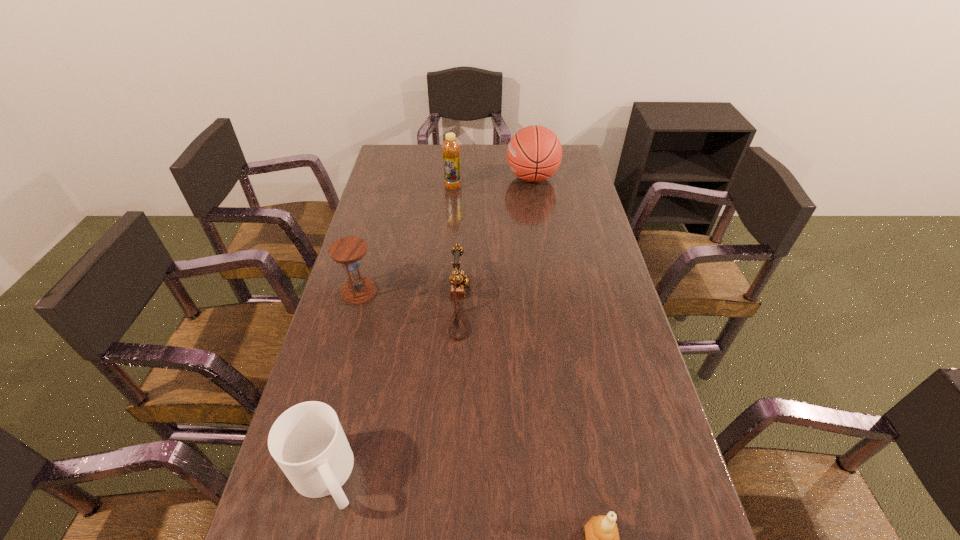
The width and height of the screenshot is (960, 540). I want to click on vacant space at the far left corner, so click(x=411, y=154).

Where is `free region at the far right corner of the desktop`? free region at the far right corner of the desktop is located at coordinates (581, 170).

The height and width of the screenshot is (540, 960). What are the coordinates of `vacant area that lies between the telephone and the hourglass` in the screenshot? It's located at (410, 298).

At what (x,y) coordinates should I click in order to perform the action: click on empty space between the hourglass and the bottle. Please return your answer as a coordinate pair (x, y). Looking at the image, I should click on (406, 239).

Identify the location of vacant area between the mug and the basketball. This screenshot has width=960, height=540. (429, 327).

Find the location of a particular element. The height and width of the screenshot is (540, 960). free space between the bottle and the basketball is located at coordinates (492, 183).

I want to click on blank region between the bottle and the hourglass, so click(x=406, y=239).

Where is `free space between the bottle and the hourglass`? free space between the bottle and the hourglass is located at coordinates (406, 239).

Identify the location of vacant area that lies between the basketball and the mug. Image resolution: width=960 pixels, height=540 pixels. (429, 327).

Identify which object is located as the third nearest to the mug. Please provide its 2D coordinates. Your answer should be formatted as a tuple, i.e. [(x, y)], where the tuple contains the x and y coordinates of a point satisfying the conditions above.

[(602, 537)]